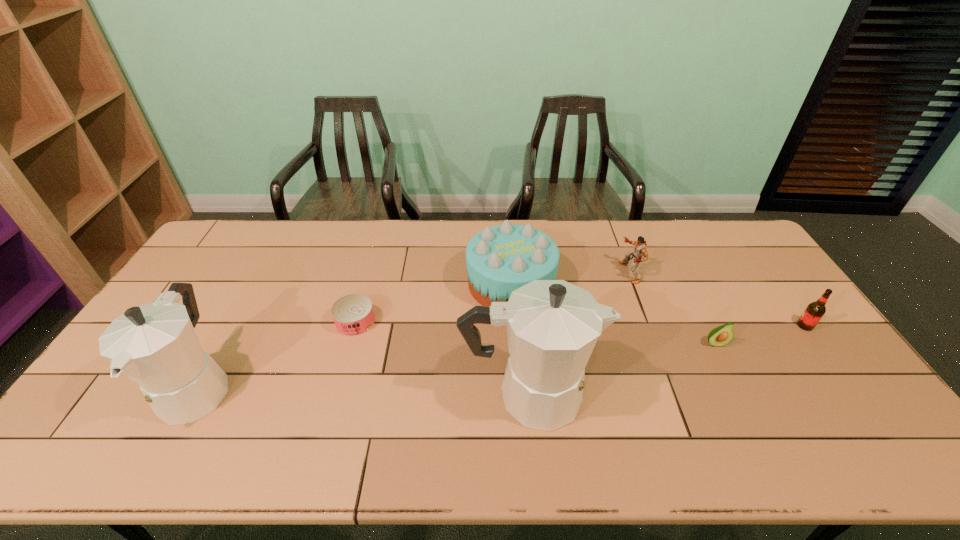
Identify the location of vacant point located between the left coffeepot and the second shortest object. The width and height of the screenshot is (960, 540). (457, 365).

The height and width of the screenshot is (540, 960). Identify the location of unoccupied area between the right coffeepot and the rightmost object. (667, 360).

This screenshot has height=540, width=960. I want to click on vacant area between the left coffeepot and the second object from right to left, so click(457, 365).

Identify which object is located as the second nearest to the leftmost object. Please provide its 2D coordinates. Your answer should be formatted as a tuple, i.e. [(x, y)], where the tuple contains the x and y coordinates of a point satisfying the conditions above.

[(552, 326)]

Identify which object is the third nearest to the third object from right to left. Please provide its 2D coordinates. Your answer should be formatted as a tuple, i.e. [(x, y)], where the tuple contains the x and y coordinates of a point satisfying the conditions above.

[(552, 326)]

Find the location of a particular element. This screenshot has width=960, height=540. free spot that satisfies the following two spatial constraints: 1. on the front-facing side of the third object from right to left; 2. on the back side of the root beer is located at coordinates (649, 326).

Where is `free spot that satisfies the following two spatial constraints: 1. on the front-facing side of the third object from right to left; 2. on the right side of the root beer`? Image resolution: width=960 pixels, height=540 pixels. free spot that satisfies the following two spatial constraints: 1. on the front-facing side of the third object from right to left; 2. on the right side of the root beer is located at coordinates pyautogui.click(x=649, y=326).

This screenshot has height=540, width=960. I want to click on blank space that satisfies the following two spatial constraints: 1. on the front side of the sixth object from right to left; 2. on the left side of the rightmost object, so click(354, 326).

Identify the location of vacant area in the image that satisfies the following two spatial constraints: 1. on the front-facing side of the fifth object from left to right; 2. on the back side of the rightmost object. (649, 326).

Where is `vacant space that satisfies the following two spatial constraints: 1. on the back side of the root beer; 2. on the front-facing side of the puncher`? The width and height of the screenshot is (960, 540). vacant space that satisfies the following two spatial constraints: 1. on the back side of the root beer; 2. on the front-facing side of the puncher is located at coordinates (766, 273).